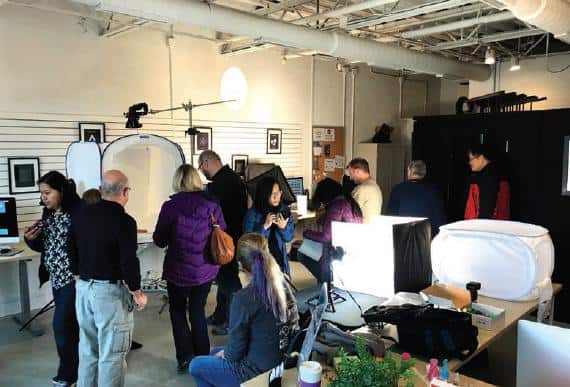
The height and width of the screenshot is (387, 570). In order to click on light in this screenshot , I will do 382,259.